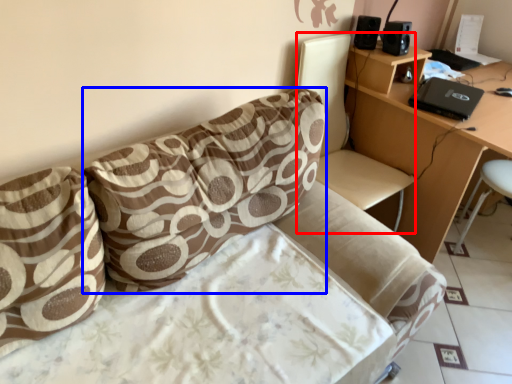
Question: Which object appears closest to the camera in this image, swivel chair (highlighted by a red box) or pillow (highlighted by a blue box)?

Choices:
 (A) swivel chair
 (B) pillow

Answer: (B)